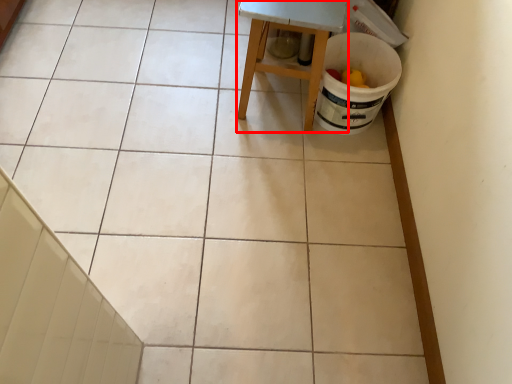
Question: From the image's perspective, considering the relative positions of furniture (annotated by the red box) and stair in the image provided, where is furniture (annotated by the red box) located with respect to the staircase?

Choices:
 (A) above
 (B) below

Answer: (A)